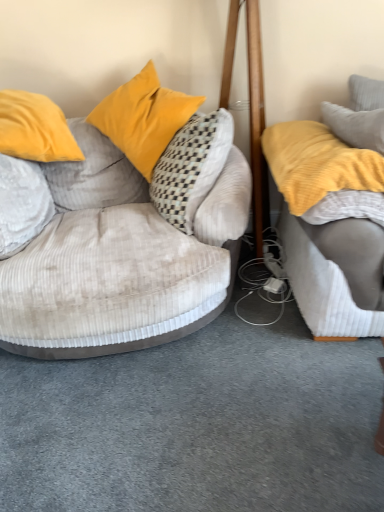
Question: Considering the relative positions of velvet beige studio couch at left, which is counted as the first studio couch, starting from the left, and yellow soft fabric studio couch at right, which ranks as the second studio couch in left-to-right order, in the image provided, is velvet beige studio couch at left, which is counted as the first studio couch, starting from the left, behind yellow soft fabric studio couch at right, which ranks as the second studio couch in left-to-right order,?

Choices:
 (A) no
 (B) yes

Answer: (A)

Question: From a real-world perspective, does velvet beige studio couch at left, which is counted as the 2th studio couch, starting from the right, stand above yellow soft fabric studio couch at right, which appears as the 1th studio couch when viewed from the right?

Choices:
 (A) yes
 (B) no

Answer: (B)

Question: Considering the relative sizes of velvet beige studio couch at left, which is counted as the 2th studio couch, starting from the right, and yellow soft fabric studio couch at right, which appears as the 1th studio couch when viewed from the right, in the image provided, is velvet beige studio couch at left, which is counted as the 2th studio couch, starting from the right, wider than yellow soft fabric studio couch at right, which appears as the 1th studio couch when viewed from the right,?

Choices:
 (A) no
 (B) yes

Answer: (B)

Question: Does velvet beige studio couch at left, which is counted as the first studio couch, starting from the left, have a lesser height compared to yellow soft fabric studio couch at right, which appears as the 1th studio couch when viewed from the right?

Choices:
 (A) yes
 (B) no

Answer: (B)

Question: Is velvet beige studio couch at left, which is counted as the first studio couch, starting from the left, at the right side of yellow soft fabric studio couch at right, which ranks as the second studio couch in left-to-right order?

Choices:
 (A) yes
 (B) no

Answer: (B)

Question: Considering the relative positions of velvet beige studio couch at left, which is counted as the first studio couch, starting from the left, and yellow soft fabric studio couch at right, which ranks as the second studio couch in left-to-right order, in the image provided, is velvet beige studio couch at left, which is counted as the first studio couch, starting from the left, in front of yellow soft fabric studio couch at right, which ranks as the second studio couch in left-to-right order,?

Choices:
 (A) no
 (B) yes

Answer: (B)

Question: From the image's perspective, is velvet yellow pillow at upper left, which is the third pillow in right-to-left order, on yellow soft fabric studio couch at right, which appears as the 1th studio couch when viewed from the right?

Choices:
 (A) no
 (B) yes

Answer: (B)

Question: From a real-world perspective, is velvet yellow pillow at upper left, which is counted as the second pillow, starting from the left, physically below yellow soft fabric studio couch at right, which appears as the 1th studio couch when viewed from the right?

Choices:
 (A) yes
 (B) no

Answer: (B)

Question: Is velvet yellow pillow at upper left, which is the third pillow in right-to-left order, oriented away from yellow soft fabric studio couch at right, which appears as the 1th studio couch when viewed from the right?

Choices:
 (A) yes
 (B) no

Answer: (B)

Question: Is velvet yellow pillow at upper left, which is the third pillow in right-to-left order, located outside yellow soft fabric studio couch at right, which appears as the 1th studio couch when viewed from the right?

Choices:
 (A) yes
 (B) no

Answer: (A)

Question: Does velvet yellow pillow at upper left, which is the third pillow in right-to-left order, have a lesser width compared to yellow soft fabric studio couch at right, which ranks as the second studio couch in left-to-right order?

Choices:
 (A) no
 (B) yes

Answer: (B)

Question: Does velvet yellow pillow at upper left, which is the third pillow in right-to-left order, have a larger size compared to yellow soft fabric studio couch at right, which appears as the 1th studio couch when viewed from the right?

Choices:
 (A) yes
 (B) no

Answer: (B)

Question: Is gray textured pillow at upper right, the 1th pillow from the right, surrounding velvet beige studio couch at left, which is counted as the first studio couch, starting from the left?

Choices:
 (A) yes
 (B) no

Answer: (B)